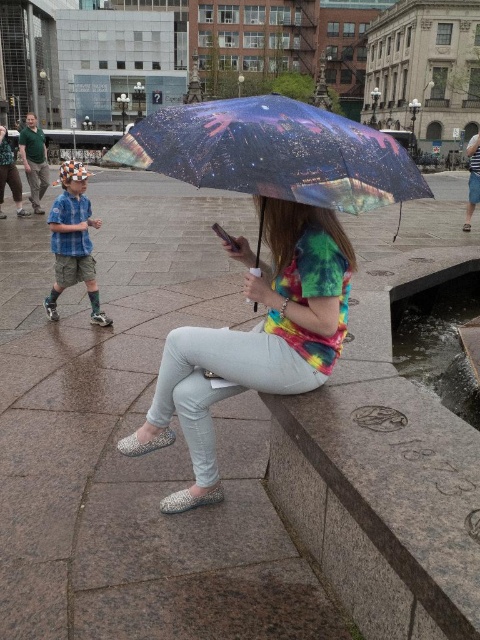
Question: Is rainbow tie-dye shirt at center bigger than matte blue shirt at left?

Choices:
 (A) yes
 (B) no

Answer: (A)

Question: Does rainbow tie-dye shirt at center have a lesser width compared to transparent printed umbrella at center?

Choices:
 (A) no
 (B) yes

Answer: (B)

Question: Which point is closer to the camera?

Choices:
 (A) rainbow tie-dye shirt at center
 (B) transparent printed umbrella at center

Answer: (B)

Question: Which point is farther from the camera taking this photo?

Choices:
 (A) (260, 387)
 (B) (204, 134)

Answer: (A)

Question: Observing the image, what is the correct spatial positioning of rainbow tie-dye shirt at center in reference to transparent printed umbrella at center?

Choices:
 (A) right
 (B) left

Answer: (B)

Question: Which object appears farthest from the camera in this image?

Choices:
 (A) transparent printed umbrella at center
 (B) matte blue shirt at left

Answer: (B)